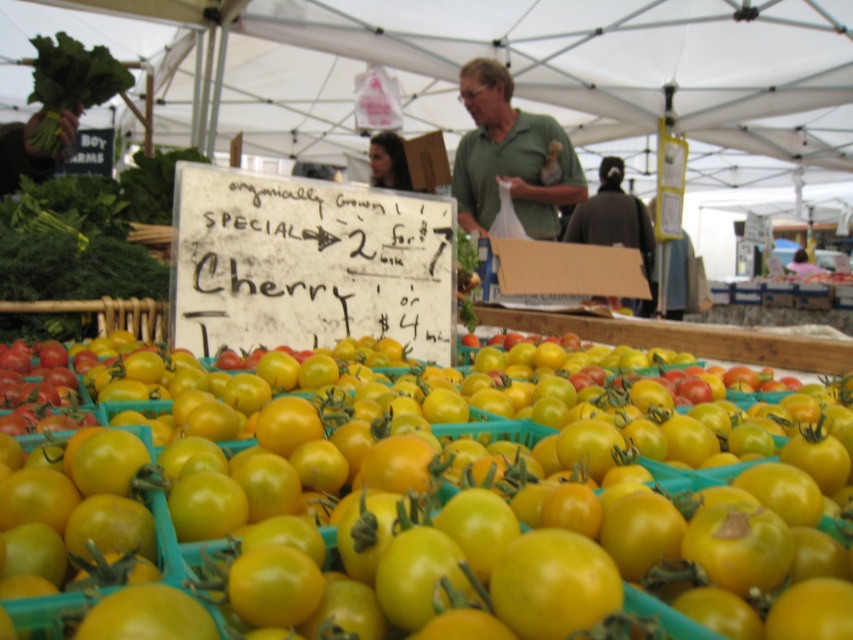
Is the position of shiny yellow tomato at center less distant than that of green matte shirt at center?

Yes, it is.

Who is positioned more to the right, shiny yellow tomato at center or green matte shirt at center?

Positioned to the right is green matte shirt at center.

Where is `shiny yellow tomato at center`? shiny yellow tomato at center is located at coordinates (450, 525).

Can you confirm if green matte shirt at center is wider than green leafy at upper left?

Yes, green matte shirt at center is wider than green leafy at upper left.

Locate an element on the screen. green matte shirt at center is located at coordinates (509, 156).

Image resolution: width=853 pixels, height=640 pixels. I want to click on green matte shirt at center, so click(x=509, y=156).

Between point (582, 573) and point (575, 209), which one is positioned in front?

Point (582, 573) is in front.

What do you see at coordinates (450, 525) in the screenshot?
I see `shiny yellow tomato at center` at bounding box center [450, 525].

Locate an element on the screen. Image resolution: width=853 pixels, height=640 pixels. shiny yellow tomato at center is located at coordinates (450, 525).